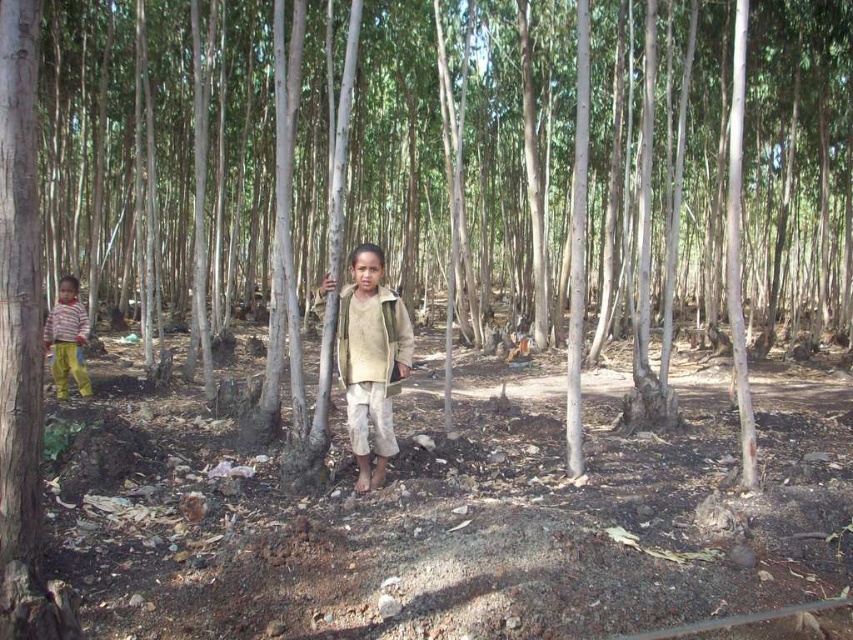
You are a hiker trying to navigate through the dense eucalyptus forest. You see two points marked in the image. Which point is closer to you, point (x=405, y=323) or point (x=76, y=314)?

Point (x=405, y=323) is closer to the viewer than point (x=76, y=314).

You are a hiker who just entered the forest and see the light beige fabric jacket at center. If your backpack is 2 meters away from you, can you reach it without moving your feet?

The light beige fabric jacket at center is 5.22 meters from the viewer. Since your backpack is only 2 meters away, you can easily reach it without moving your feet.